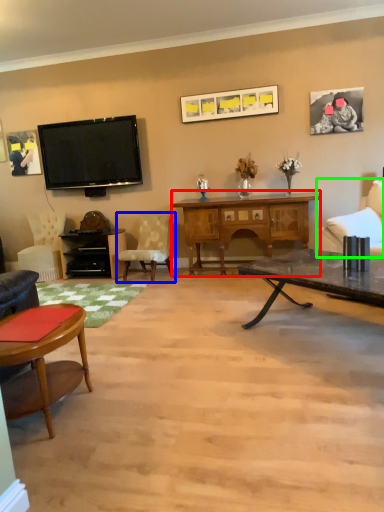
Question: Considering the real-world distances, which object is farthest from desk (highlighted by a red box)? chair (highlighted by a blue box) or chair (highlighted by a green box)?

Choices:
 (A) chair
 (B) chair

Answer: (B)